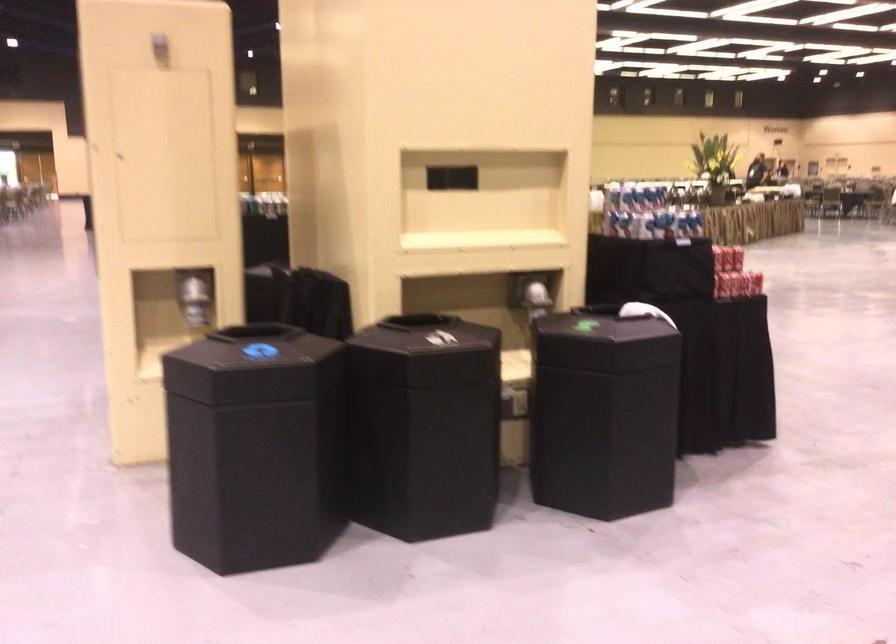
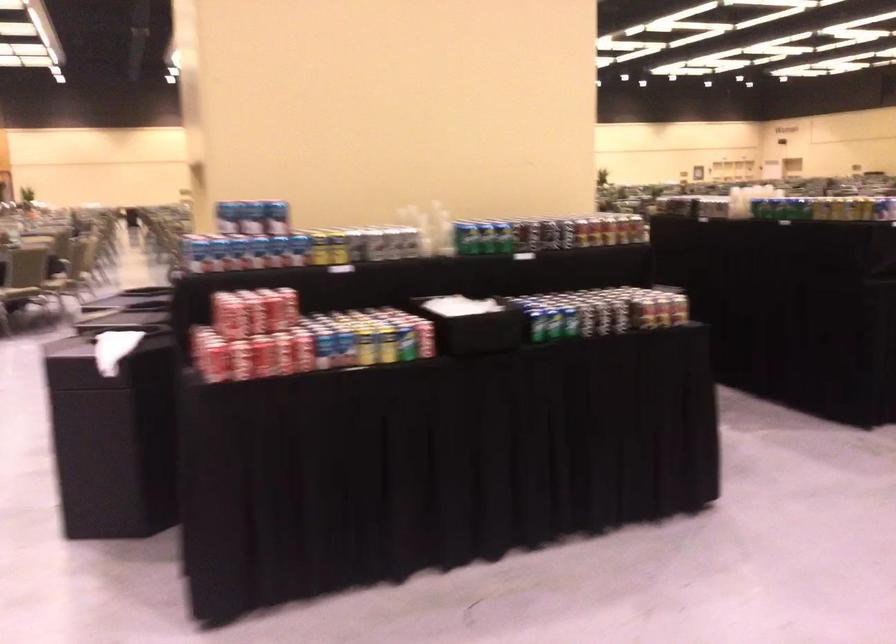
Question: I am providing you with two images of the same scene from different viewpoints. Please identify which objects are invisible in image2.

Choices:
 (A) clear glass cup
 (B) yellow soda can
 (C) black napkin holder
 (D) shiny dispenser lever

Answer: (D)